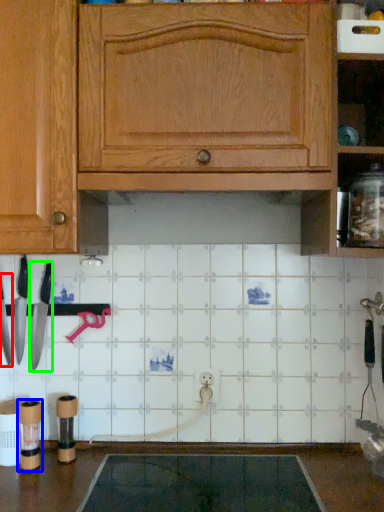
Question: Which is farther away from knife (highlighted by a red box)? appliance (highlighted by a blue box) or knife (highlighted by a green box)?

Choices:
 (A) appliance
 (B) knife

Answer: (A)